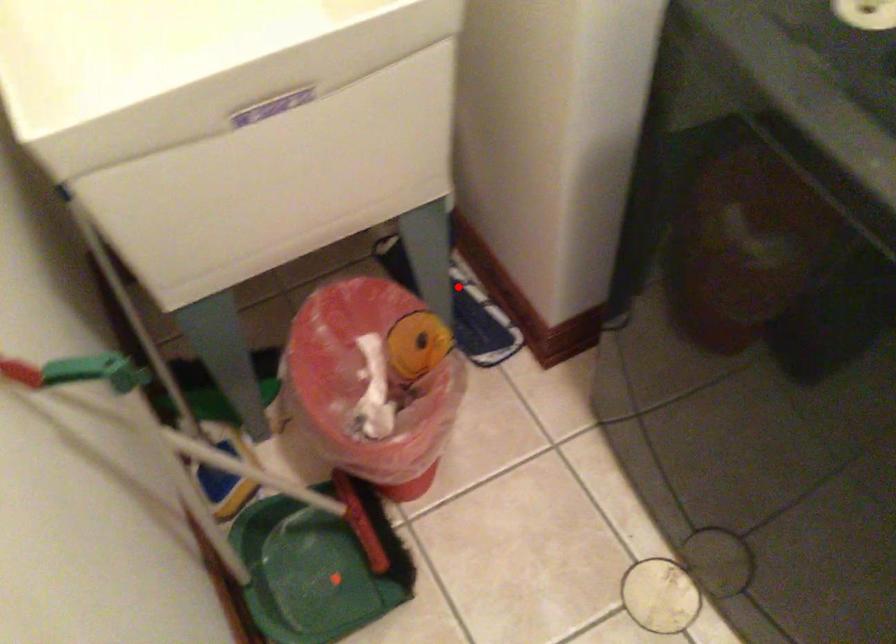
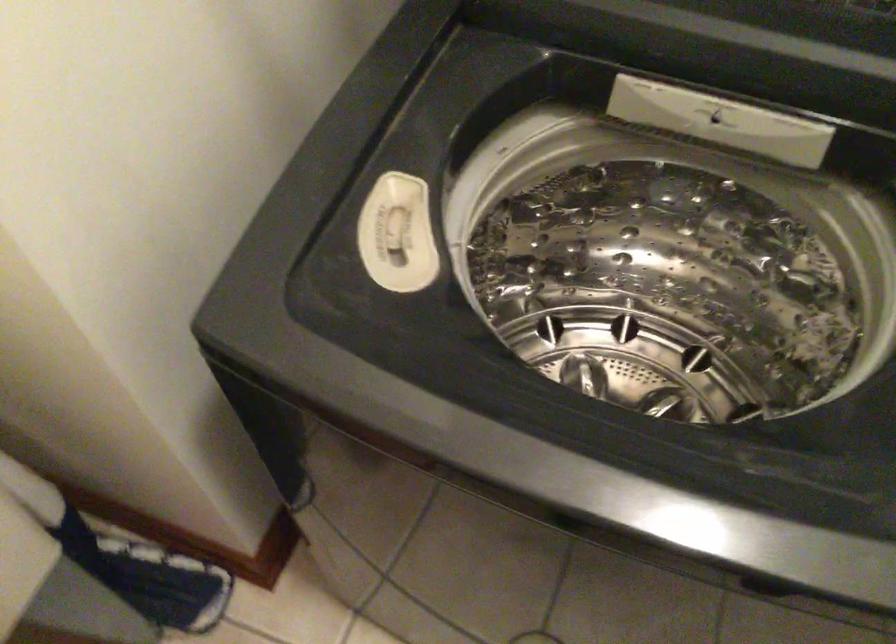
Where in the second image is the point corresponding to the highlighted location from the first image?

(125, 560)